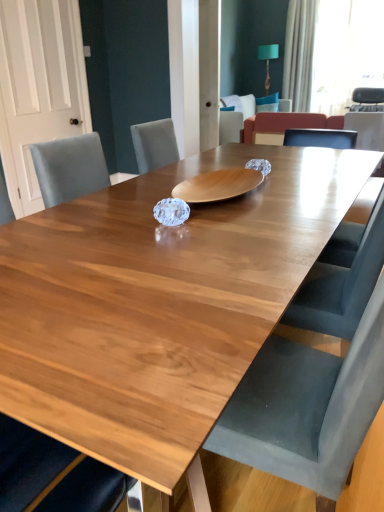
Question: From a real-world perspective, is wooden table at center under white fabric curtain at upper right?

Choices:
 (A) yes
 (B) no

Answer: (A)

Question: Is there a large distance between wooden table at center and white fabric curtain at upper right?

Choices:
 (A) yes
 (B) no

Answer: (A)

Question: Is wooden table at center aimed at white fabric curtain at upper right?

Choices:
 (A) yes
 (B) no

Answer: (B)

Question: Is wooden table at center next to white fabric curtain at upper right and touching it?

Choices:
 (A) no
 (B) yes

Answer: (A)

Question: Can you confirm if wooden table at center is smaller than white fabric curtain at upper right?

Choices:
 (A) no
 (B) yes

Answer: (B)

Question: Is point (251, 103) positioned closer to the camera than point (59, 387)?

Choices:
 (A) farther
 (B) closer

Answer: (A)

Question: In terms of size, does velvet armchair at center, the second armchair viewed from the right, appear bigger or smaller than wooden table at center?

Choices:
 (A) small
 (B) big

Answer: (B)

Question: From a real-world perspective, relative to wooden table at center, is velvet armchair at center, the 1th armchair from the left, vertically above or below?

Choices:
 (A) below
 (B) above

Answer: (A)

Question: Is velvet armchair at center, the 1th armchair from the left, wider or thinner than wooden table at center?

Choices:
 (A) thin
 (B) wide

Answer: (B)

Question: From a real-world perspective, is white fabric curtain at upper right physically located above or below white sheer curtain at upper right?

Choices:
 (A) above
 (B) below

Answer: (B)

Question: From the image's perspective, is white fabric curtain at upper right above or below white sheer curtain at upper right?

Choices:
 (A) above
 (B) below

Answer: (B)

Question: Is point (286, 80) closer or farther from the camera than point (367, 75)?

Choices:
 (A) closer
 (B) farther

Answer: (B)

Question: Would you say white fabric curtain at upper right is to the left or to the right of white sheer curtain at upper right in the picture?

Choices:
 (A) left
 (B) right

Answer: (A)

Question: Based on their positions, is white sheer curtain at upper right located to the left or right of wooden table at center?

Choices:
 (A) left
 (B) right

Answer: (B)

Question: From their relative heights in the image, would you say white sheer curtain at upper right is taller or shorter than wooden table at center?

Choices:
 (A) short
 (B) tall

Answer: (B)